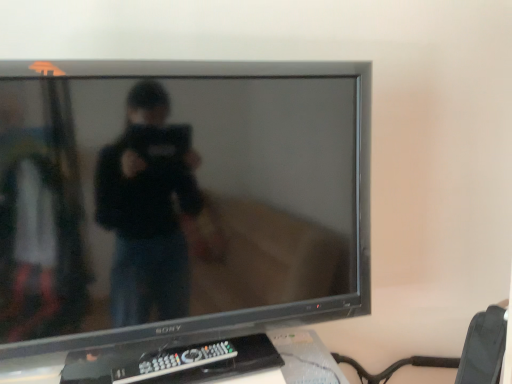
Question: From a real-world perspective, is satin black tv at center above or below black plastic remote at lower center?

Choices:
 (A) above
 (B) below

Answer: (A)

Question: Does point click(x=227, y=249) appear closer or farther from the camera than point click(x=172, y=359)?

Choices:
 (A) farther
 (B) closer

Answer: (A)

Question: Is satin black tv at center in front of or behind black plastic remote at lower center in the image?

Choices:
 (A) behind
 (B) front

Answer: (B)

Question: Based on their positions, is black plastic remote at lower center located to the left or right of satin black tv at center?

Choices:
 (A) left
 (B) right

Answer: (A)

Question: Is black plastic remote at lower center bigger or smaller than satin black tv at center?

Choices:
 (A) big
 (B) small

Answer: (B)

Question: In terms of height, does black plastic remote at lower center look taller or shorter compared to satin black tv at center?

Choices:
 (A) tall
 (B) short

Answer: (B)

Question: Relative to satin black tv at center, is black plastic remote at lower center in front or behind?

Choices:
 (A) behind
 (B) front

Answer: (A)